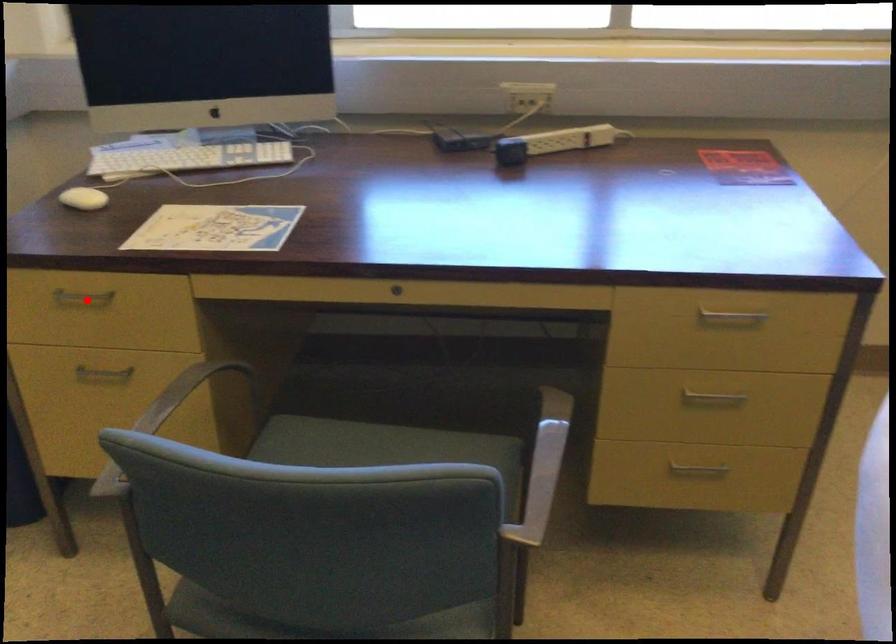
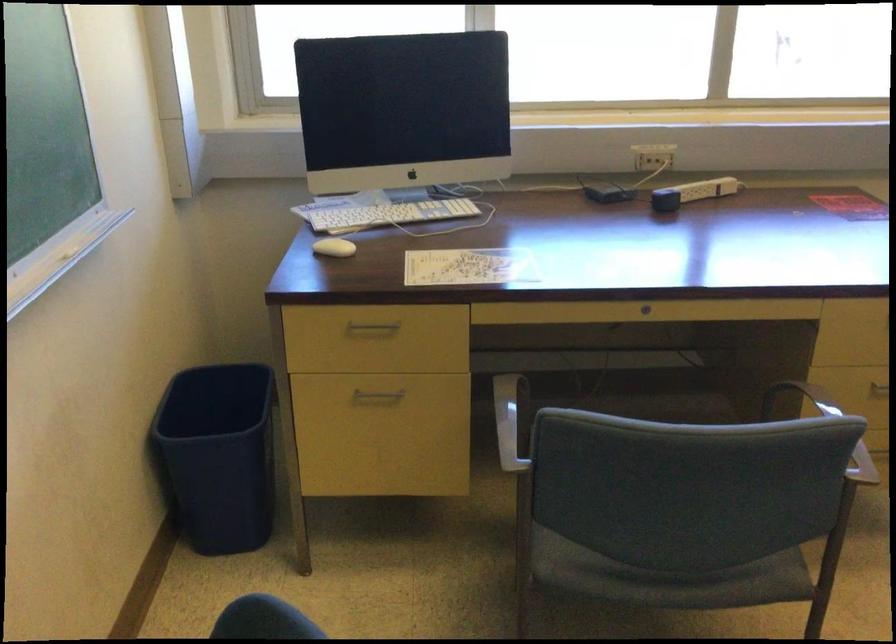
Question: A red point is marked in image1. In image2, is the corresponding 3D point closer to the camera or farther? Reply with the corresponding letter.

Choices:
 (A) The corresponding 3D point is closer.
 (B) The corresponding 3D point is farther.

Answer: (B)